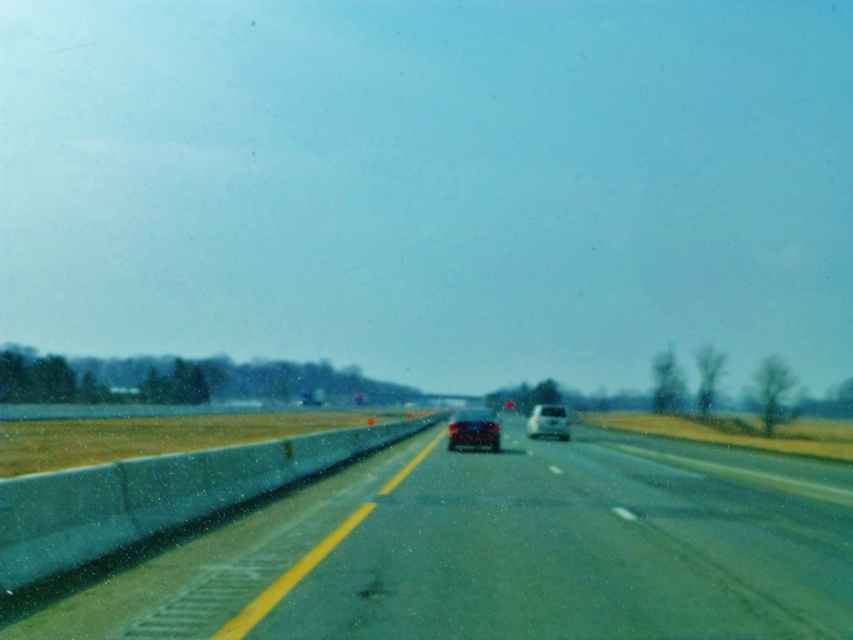
Question: Can you confirm if smooth asphalt road at center is bigger than white glossy car at center?

Choices:
 (A) yes
 (B) no

Answer: (A)

Question: Can you confirm if shiny silver sedan at center is positioned to the left of white glossy car at center?

Choices:
 (A) yes
 (B) no

Answer: (A)

Question: Does shiny silver sedan at center appear under white glossy car at center?

Choices:
 (A) yes
 (B) no

Answer: (B)

Question: Estimate the real-world distances between objects in this image. Which object is farther from the white glossy car at center?

Choices:
 (A) smooth asphalt road at center
 (B) shiny silver sedan at center

Answer: (A)

Question: Among these points, which one is farthest from the camera?

Choices:
 (A) (561, 426)
 (B) (550, 531)
 (C) (469, 428)

Answer: (A)

Question: Which object is positioned farthest from the shiny silver sedan at center?

Choices:
 (A) white glossy car at center
 (B) smooth asphalt road at center

Answer: (A)